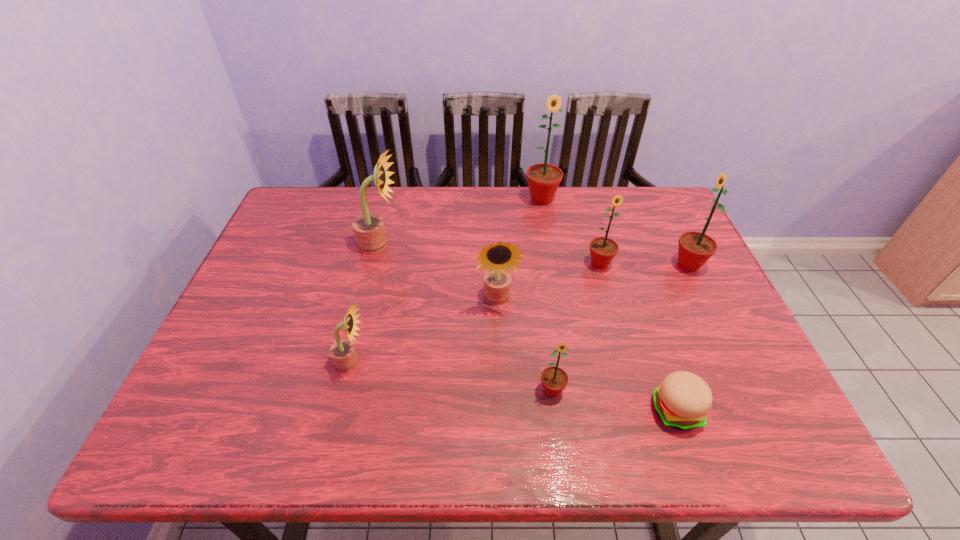
Identify the location of free space in the image that satisfies the following two spatial constraints: 1. on the face of the biggest yellow sunflower; 2. on the left side of the hamburger. Image resolution: width=960 pixels, height=540 pixels. (339, 410).

Image resolution: width=960 pixels, height=540 pixels. I want to click on vacant space that satisfies the following two spatial constraints: 1. on the face of the nearest green sunflower; 2. on the left side of the beige hamburger, so click(555, 410).

The image size is (960, 540). I want to click on free space that satisfies the following two spatial constraints: 1. on the face of the rightmost sunflower; 2. on the face of the smallest green sunflower, so click(x=749, y=390).

Identify the location of vacant space that satisfies the following two spatial constraints: 1. on the face of the hamburger; 2. on the left side of the tallest sunflower. This screenshot has width=960, height=540. (577, 410).

The image size is (960, 540). Identify the location of free space that satisfies the following two spatial constraints: 1. on the face of the rightmost green sunflower; 2. on the face of the nearest sunflower. (749, 390).

At what (x,y) coordinates should I click in order to perform the action: click on blank space that satisfies the following two spatial constraints: 1. on the face of the hamburger; 2. on the right side of the sixth farthest sunflower. Please return your answer as a coordinate pair (x, y). Image resolution: width=960 pixels, height=540 pixels. Looking at the image, I should click on (340, 410).